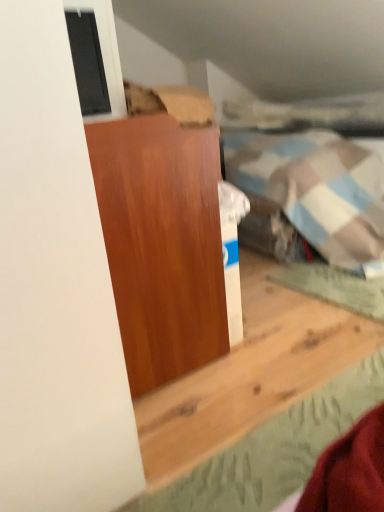
Question: Is point (145, 245) positioned closer to the camera than point (114, 42)?

Choices:
 (A) farther
 (B) closer

Answer: (B)

Question: In the image, is matte wood cabinet at center on the left side or the right side of matte glass window at upper left?

Choices:
 (A) right
 (B) left

Answer: (A)

Question: Is matte wood cabinet at center wider or thinner than matte glass window at upper left?

Choices:
 (A) thin
 (B) wide

Answer: (B)

Question: Considering the positions of matte glass window at upper left and matte wood cabinet at center in the image, is matte glass window at upper left wider or thinner than matte wood cabinet at center?

Choices:
 (A) thin
 (B) wide

Answer: (A)

Question: From the image's perspective, is matte glass window at upper left positioned above or below matte wood cabinet at center?

Choices:
 (A) below
 (B) above

Answer: (B)

Question: In the image, is matte glass window at upper left on the left side or the right side of matte wood cabinet at center?

Choices:
 (A) left
 (B) right

Answer: (A)

Question: Choose the correct answer: Is matte glass window at upper left inside matte wood cabinet at center or outside it?

Choices:
 (A) inside
 (B) outside

Answer: (B)